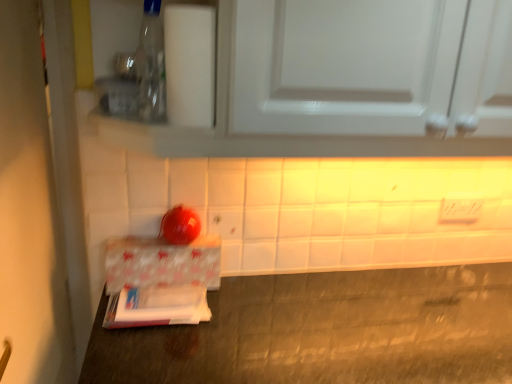
Question: Is white glossy door at left in contact with patterned paperboard at lower left?

Choices:
 (A) yes
 (B) no

Answer: (B)

Question: From a real-world perspective, is white glossy door at left over patterned paperboard at lower left?

Choices:
 (A) yes
 (B) no

Answer: (A)

Question: Is white glossy door at left wider than patterned paperboard at lower left?

Choices:
 (A) no
 (B) yes

Answer: (B)

Question: Considering the relative sizes of white glossy door at left and patterned paperboard at lower left in the image provided, is white glossy door at left thinner than patterned paperboard at lower left?

Choices:
 (A) no
 (B) yes

Answer: (A)

Question: Does white glossy door at left have a greater height compared to patterned paperboard at lower left?

Choices:
 (A) yes
 (B) no

Answer: (A)

Question: Based on their positions, is transparent plastic bottle at upper left located to the left or right of patterned paperboard at lower left?

Choices:
 (A) left
 (B) right

Answer: (A)

Question: In terms of size, does transparent plastic bottle at upper left appear bigger or smaller than patterned paperboard at lower left?

Choices:
 (A) small
 (B) big

Answer: (A)

Question: Is transparent plastic bottle at upper left situated inside patterned paperboard at lower left or outside?

Choices:
 (A) outside
 (B) inside

Answer: (A)

Question: From their relative heights in the image, would you say transparent plastic bottle at upper left is taller or shorter than patterned paperboard at lower left?

Choices:
 (A) short
 (B) tall

Answer: (B)

Question: Choose the correct answer: Is white glossy cabinet at upper center inside white glossy door at left or outside it?

Choices:
 (A) outside
 (B) inside

Answer: (A)

Question: Does point (111, 137) appear closer or farther from the camera than point (0, 115)?

Choices:
 (A) farther
 (B) closer

Answer: (A)

Question: Based on their sizes in the image, would you say white glossy cabinet at upper center is bigger or smaller than white glossy door at left?

Choices:
 (A) small
 (B) big

Answer: (B)

Question: In the image, is white glossy cabinet at upper center positioned in front of or behind white glossy door at left?

Choices:
 (A) front
 (B) behind

Answer: (B)

Question: Is transparent plastic bottle at upper left taller or shorter than white glossy door at left?

Choices:
 (A) short
 (B) tall

Answer: (A)

Question: In terms of width, does transparent plastic bottle at upper left look wider or thinner when compared to white glossy door at left?

Choices:
 (A) thin
 (B) wide

Answer: (A)